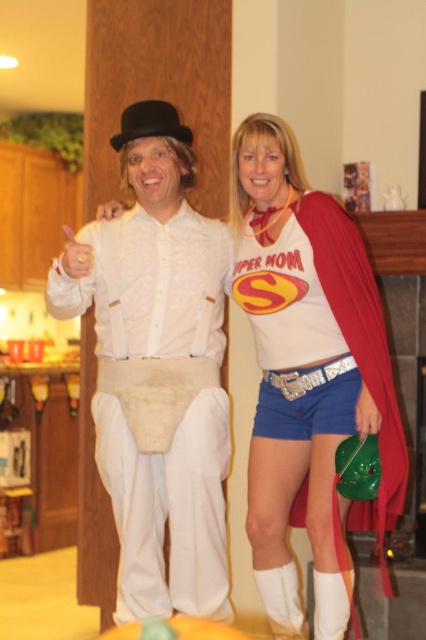
Question: Which of the following is the closest to the observer?

Choices:
 (A) matte red cape at center
 (B) white cotton pants at center

Answer: (B)

Question: Is white cotton pants at center closer to the viewer compared to matte red cape at center?

Choices:
 (A) no
 (B) yes

Answer: (B)

Question: Is white cotton pants at center to the left of matte red cape at center from the viewer's perspective?

Choices:
 (A) no
 (B) yes

Answer: (B)

Question: Which of the following is the farthest from the observer?

Choices:
 (A) matte red cape at center
 (B) white cotton pants at center

Answer: (A)

Question: Observing the image, what is the correct spatial positioning of white cotton pants at center in reference to matte red cape at center?

Choices:
 (A) below
 (B) above

Answer: (B)